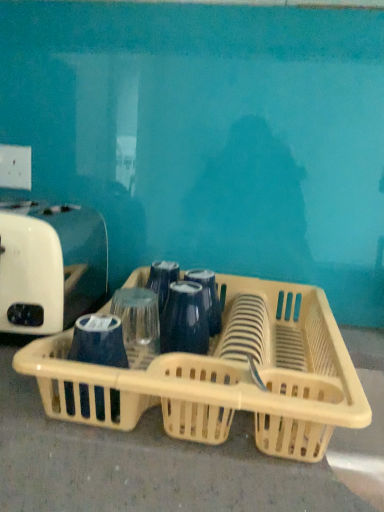
Question: Does beige plastic basket at center have a larger size compared to white plastic toaster at left?

Choices:
 (A) no
 (B) yes

Answer: (B)

Question: Is beige plastic basket at center surrounding white plastic toaster at left?

Choices:
 (A) yes
 (B) no

Answer: (B)

Question: Does beige plastic basket at center have a greater width compared to white plastic toaster at left?

Choices:
 (A) yes
 (B) no

Answer: (A)

Question: Is beige plastic basket at center at the right side of white plastic toaster at left?

Choices:
 (A) yes
 (B) no

Answer: (A)

Question: Is beige plastic basket at center turned away from white plastic toaster at left?

Choices:
 (A) yes
 (B) no

Answer: (B)

Question: From the image's perspective, is beige plastic basket at center located beneath white plastic toaster at left?

Choices:
 (A) yes
 (B) no

Answer: (A)

Question: Is white plastic toaster at left positioned behind beige plastic basket at center?

Choices:
 (A) yes
 (B) no

Answer: (A)

Question: From the image's perspective, is white plastic toaster at left over beige plastic basket at center?

Choices:
 (A) yes
 (B) no

Answer: (A)

Question: Is the depth of white plastic toaster at left less than that of beige plastic basket at center?

Choices:
 (A) yes
 (B) no

Answer: (B)

Question: Is beige plastic basket at center at the back of white plastic toaster at left?

Choices:
 (A) no
 (B) yes

Answer: (A)

Question: Does white plastic toaster at left have a larger size compared to beige plastic basket at center?

Choices:
 (A) no
 (B) yes

Answer: (A)

Question: From a real-world perspective, is white plastic toaster at left physically below beige plastic basket at center?

Choices:
 (A) no
 (B) yes

Answer: (A)

Question: Is beige plastic basket at center bigger or smaller than white plastic toaster at left?

Choices:
 (A) small
 (B) big

Answer: (B)